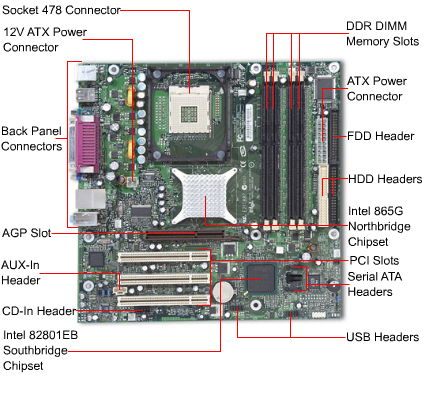
You are a GUI agent. You are given a task and a screenshot of the screen. Output one action in this format:
    pyautogui.click(x=<x>, y=<y>)
    Task: Click on the computer system board
    
    Given the screenshot: What is the action you would take?
    pyautogui.click(x=253, y=187)